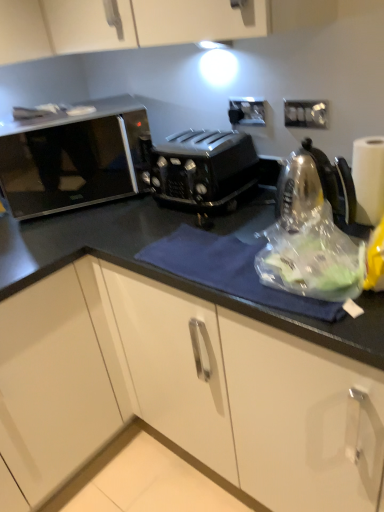
Question: From the image's perspective, is black plastic electric outlet at upper center, which is the second electric outlet from front to back, on white paper at right?

Choices:
 (A) yes
 (B) no

Answer: (A)

Question: Is black plastic electric outlet at upper center, the 1th electric outlet positioned from the back, positioned with its back to white paper at right?

Choices:
 (A) yes
 (B) no

Answer: (B)

Question: Is black plastic electric outlet at upper center, which is the second electric outlet from front to back, next to white paper at right and touching it?

Choices:
 (A) no
 (B) yes

Answer: (A)

Question: Considering the relative sizes of black plastic electric outlet at upper center, the 1th electric outlet positioned from the back, and white paper at right in the image provided, is black plastic electric outlet at upper center, the 1th electric outlet positioned from the back, shorter than white paper at right?

Choices:
 (A) no
 (B) yes

Answer: (B)

Question: Does black plastic electric outlet at upper center, marked as the second electric outlet in a right-to-left arrangement, have a greater height compared to white paper at right?

Choices:
 (A) no
 (B) yes

Answer: (A)

Question: Considering the relative sizes of black plastic electric outlet at upper center, the 1th electric outlet positioned from the back, and white paper at right in the image provided, is black plastic electric outlet at upper center, the 1th electric outlet positioned from the back, smaller than white paper at right?

Choices:
 (A) yes
 (B) no

Answer: (A)

Question: From a real-world perspective, is white plastic electric outlet at upper right, which is the first electric outlet in front-to-back order, located higher than white paper at right?

Choices:
 (A) no
 (B) yes

Answer: (B)

Question: Is white plastic electric outlet at upper right, marked as the first electric outlet in a right-to-left arrangement, oriented away from white paper at right?

Choices:
 (A) yes
 (B) no

Answer: (B)

Question: Does white plastic electric outlet at upper right, marked as the first electric outlet in a right-to-left arrangement, have a lesser width compared to white paper at right?

Choices:
 (A) yes
 (B) no

Answer: (A)

Question: Considering the relative positions of white plastic electric outlet at upper right, the 2th electric outlet when ordered from back to front, and white paper at right in the image provided, is white plastic electric outlet at upper right, the 2th electric outlet when ordered from back to front, to the right of white paper at right from the viewer's perspective?

Choices:
 (A) no
 (B) yes

Answer: (A)

Question: From a real-world perspective, is white plastic electric outlet at upper right, which is the first electric outlet in front-to-back order, located beneath white paper at right?

Choices:
 (A) yes
 (B) no

Answer: (B)

Question: Is white plastic electric outlet at upper right, the second electric outlet viewed from the left, wider than white paper at right?

Choices:
 (A) yes
 (B) no

Answer: (B)

Question: From a real-world perspective, does white paper at right sit lower than white plastic electric outlet at upper right, the 2th electric outlet when ordered from back to front?

Choices:
 (A) no
 (B) yes

Answer: (B)